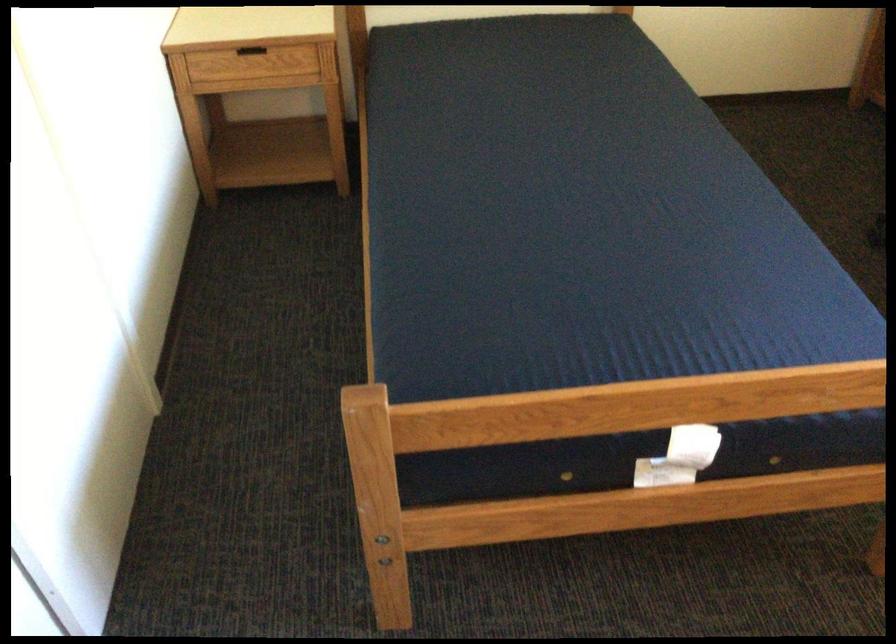
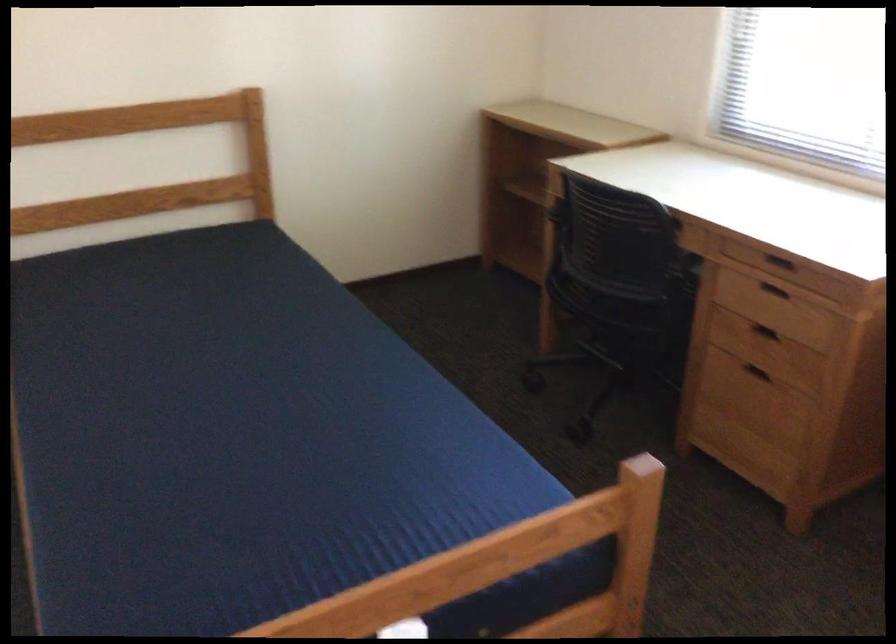
Question: Which direction would the cameraman need to move to produce the second image? Reply with the corresponding letter.

Choices:
 (A) Left
 (B) Right
 (C) Forward
 (D) Backward

Answer: (B)